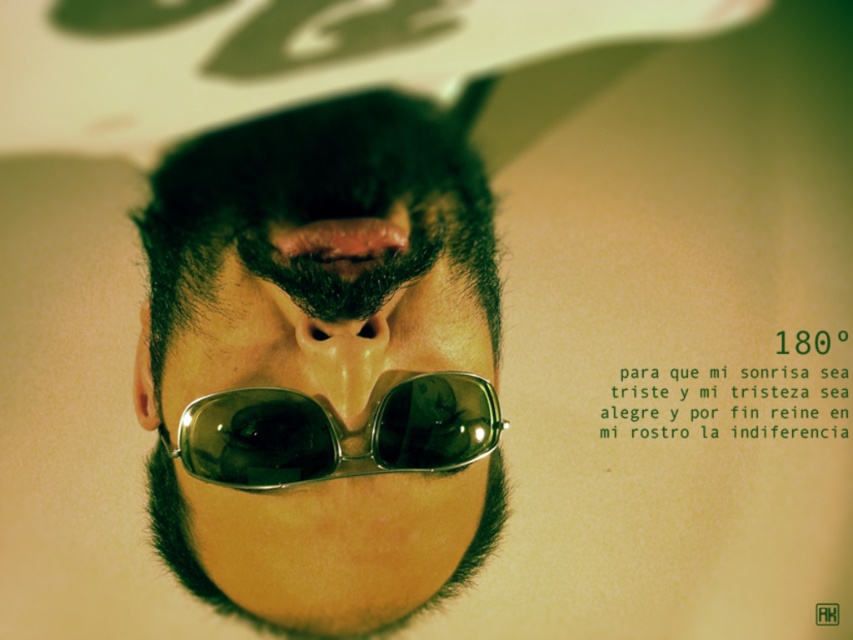
Describe the element at coordinates (320, 358) in the screenshot. I see `shiny metallic sunglasses at center` at that location.

Consider the image. Can you confirm if shiny metallic sunglasses at center is wider than matte brown nose at center?

Indeed, shiny metallic sunglasses at center has a greater width compared to matte brown nose at center.

Who is more forward, (389,152) or (320,332)?

Point (320,332)

Image resolution: width=853 pixels, height=640 pixels. What are the coordinates of `shiny metallic sunglasses at center` in the screenshot? It's located at (320, 358).

Where is `shiny metallic sunglasses at center`? shiny metallic sunglasses at center is located at coordinates [320, 358].

Between point (288, 387) and point (387, 452), which one is positioned behind?

The point (387, 452) is more distant.

I want to click on shiny metallic sunglasses at center, so click(x=320, y=358).

Does smokey gray metallic goggles at center have a greater width compared to matte brown nose at center?

Yes.

What do you see at coordinates (335, 433) in the screenshot? The image size is (853, 640). I see `smokey gray metallic goggles at center` at bounding box center [335, 433].

Locate an element on the screen. This screenshot has width=853, height=640. smokey gray metallic goggles at center is located at coordinates (335, 433).

This screenshot has width=853, height=640. In order to click on smokey gray metallic goggles at center in this screenshot , I will do 335,433.